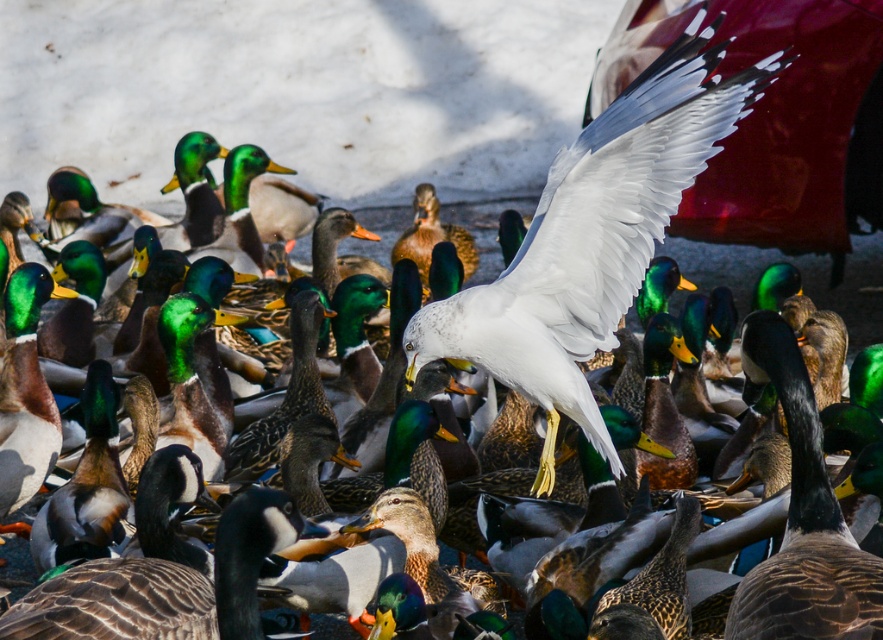
Question: Is white feathered seagull at center smaller than green glossy duck at center?

Choices:
 (A) yes
 (B) no

Answer: (B)

Question: Based on their relative distances, which object is nearer to the green glossy duck at left?

Choices:
 (A) brown feathered duck at center
 (B) green glossy duck at center
 (C) white feathered seagull at center
 (D) brown speckled goose at center

Answer: (C)

Question: Is brown speckled goose at center above green glossy duck at left?

Choices:
 (A) yes
 (B) no

Answer: (B)

Question: Considering the real-world distances, which object is farthest from the white feathered seagull at center?

Choices:
 (A) brown speckled goose at center
 (B) green glossy duck at left
 (C) green glossy duck at center

Answer: (C)

Question: Is green glossy duck at left wider than green glossy duck at center?

Choices:
 (A) yes
 (B) no

Answer: (B)

Question: Among these objects, which one is farthest from the camera?

Choices:
 (A) brown feathered duck at center
 (B) white feathered seagull at center
 (C) green glossy duck at left
 (D) brown speckled goose at center

Answer: (C)